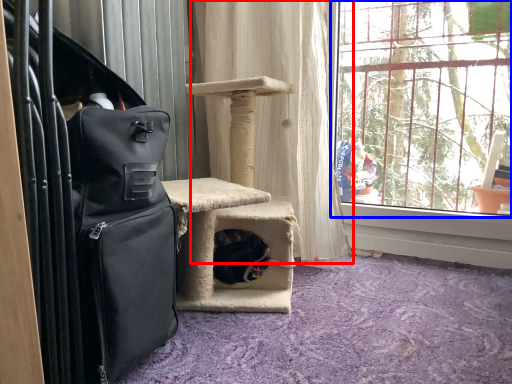
Question: Which point is further to the camera, curtain (highlighted by a red box) or window (highlighted by a blue box)?

Choices:
 (A) curtain
 (B) window

Answer: (A)